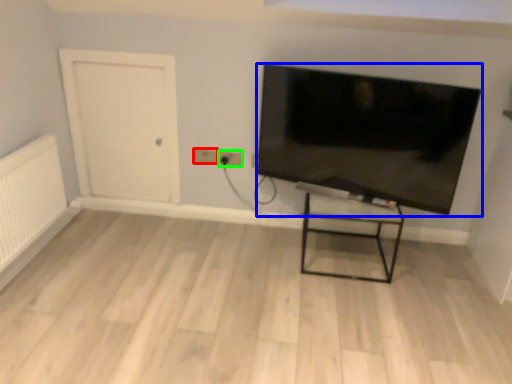
Question: Considering the real-world distances, which object is closest to electric outlet (highlighted by a red box)? television (highlighted by a blue box) or electric outlet (highlighted by a green box).

Choices:
 (A) television
 (B) electric outlet

Answer: (B)